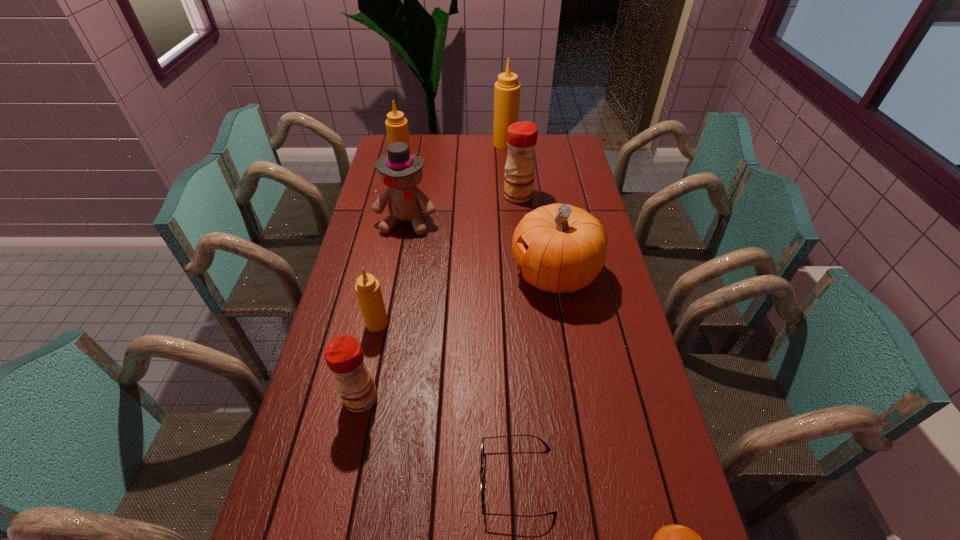
Where is `the biggest tan condiment`? the biggest tan condiment is located at coordinates (507, 89).

Find the location of a particular element. This screenshot has width=960, height=540. the farthest condiment is located at coordinates (507, 89).

The width and height of the screenshot is (960, 540). Identify the location of the second farthest condiment. (397, 130).

Find the location of a particular element. The width and height of the screenshot is (960, 540). the second biggest tan condiment is located at coordinates (397, 130).

The image size is (960, 540). Find the location of `the right red condiment`. the right red condiment is located at coordinates (519, 176).

I want to click on the bigger red condiment, so click(x=519, y=176).

Find the location of a particular element. Image resolution: width=960 pixels, height=540 pixels. the sixth nearest object is located at coordinates (401, 172).

This screenshot has width=960, height=540. I want to click on the fifth farthest object, so click(564, 248).

Where is `orange pumpkin`? This screenshot has width=960, height=540. orange pumpkin is located at coordinates (564, 248).

At what (x,y) coordinates should I click in order to perform the action: click on the smallest tan condiment. Please return your answer as a coordinate pair (x, y). Looking at the image, I should click on (367, 287).